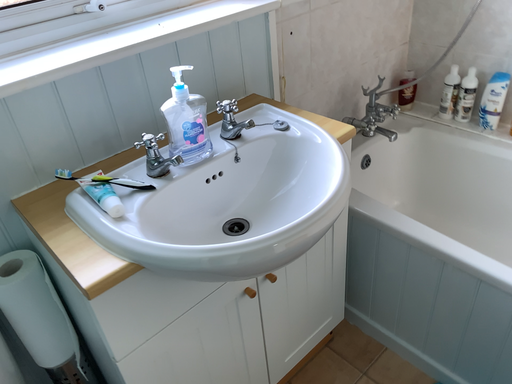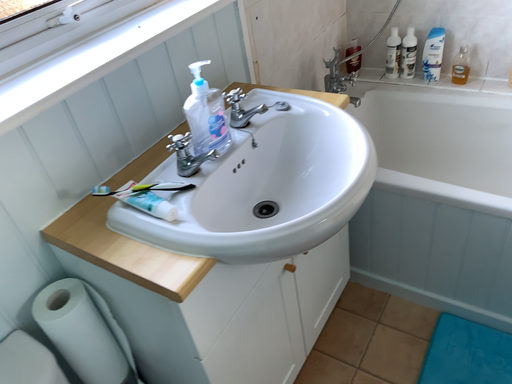
Question: How did the camera likely rotate when shooting the video?

Choices:
 (A) rotated left
 (B) rotated right

Answer: (B)